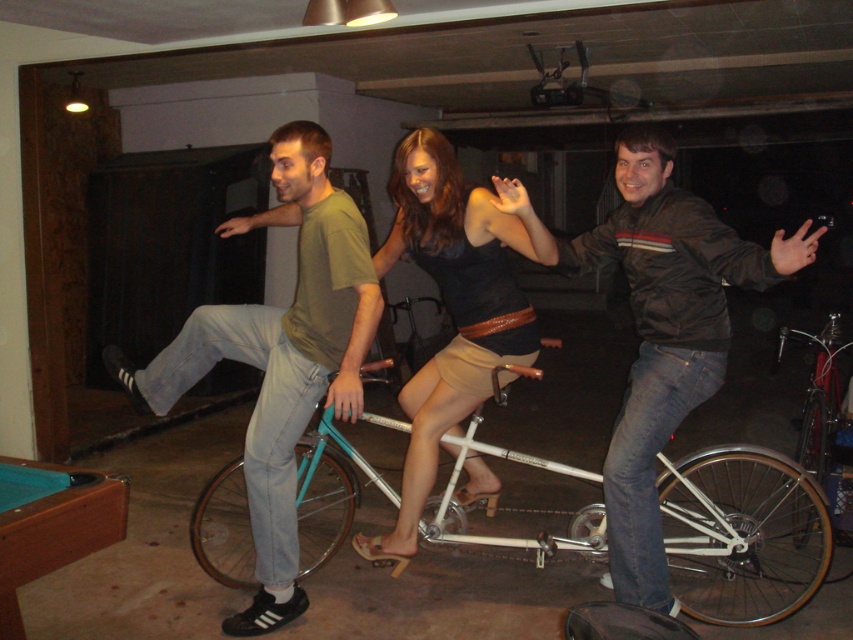
Is point (502, 189) less distant than point (825, 397)?

Yes.

Is matte black tank top at center to the right of silver metallic bicycle at center from the viewer's perspective?

Incorrect, matte black tank top at center is not on the right side of silver metallic bicycle at center.

The width and height of the screenshot is (853, 640). I want to click on matte black tank top at center, so click(454, 305).

This screenshot has height=640, width=853. In order to click on matte black tank top at center in this screenshot , I will do `click(454, 305)`.

Describe the element at coordinates (666, 336) in the screenshot. This screenshot has height=640, width=853. I see `dark brown leather jacket at center` at that location.

You are a GUI agent. You are given a task and a screenshot of the screen. Output one action in this format:
    pyautogui.click(x=<x>, y=<y>)
    Task: Click on the dark brown leather jacket at center
    The image size is (853, 640).
    Given the screenshot: What is the action you would take?
    pyautogui.click(x=666, y=336)

Does point (775, 477) come closer to viewer compared to point (473, 465)?

No.

Where is `white metallic bicycle at center`? The image size is (853, 640). white metallic bicycle at center is located at coordinates (741, 532).